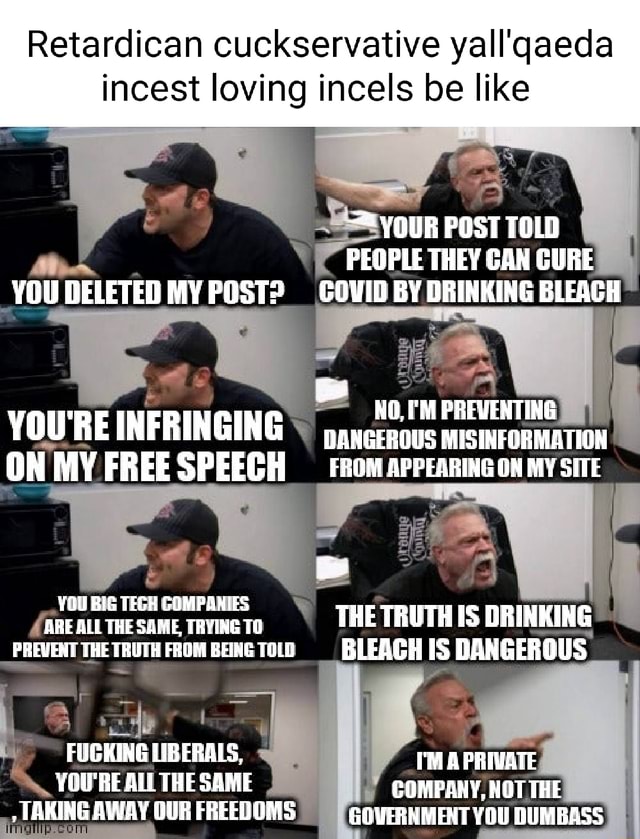
What are the coordinates of `chair` in the screenshot? It's located at (95, 684).